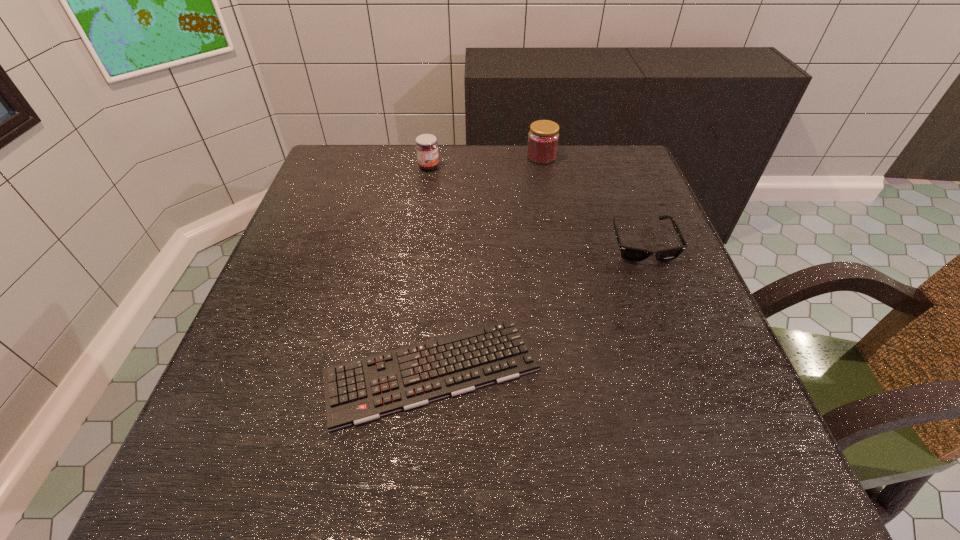
Find the location of `free area in between the left jam and the nearest object`. free area in between the left jam and the nearest object is located at coordinates (430, 268).

The image size is (960, 540). I want to click on free spot between the second nearest object and the right jam, so click(x=591, y=200).

At what (x,y) coordinates should I click in order to perform the action: click on free spot between the rightmost object and the second object from right to left. Please return your answer as a coordinate pair (x, y). This screenshot has width=960, height=540. Looking at the image, I should click on pyautogui.click(x=591, y=200).

You are a GUI agent. You are given a task and a screenshot of the screen. Output one action in this format:
    pyautogui.click(x=<x>, y=<y>)
    Task: Click on the free space that is in between the second object from right to left and the third farthest object
    The image size is (960, 540).
    Given the screenshot: What is the action you would take?
    pyautogui.click(x=591, y=200)

This screenshot has width=960, height=540. I want to click on unoccupied area between the second nearest object and the shortest object, so click(537, 307).

This screenshot has width=960, height=540. In order to click on vacant region between the third farthest object and the second object from right to left in this screenshot , I will do `click(591, 200)`.

You are a GUI agent. You are given a task and a screenshot of the screen. Output one action in this format:
    pyautogui.click(x=<x>, y=<y>)
    Task: Click on the vacant region between the right jam and the left jam
    This screenshot has height=540, width=960.
    Given the screenshot: What is the action you would take?
    pyautogui.click(x=485, y=162)

At what (x,y) coordinates should I click in order to perform the action: click on vacant space that's between the third farthest object and the nearest object. Please return your answer as a coordinate pair (x, y). This screenshot has width=960, height=540. Looking at the image, I should click on (537, 307).

Where is `object that is the third nearest to the nearest object`? object that is the third nearest to the nearest object is located at coordinates (543, 137).

The height and width of the screenshot is (540, 960). Find the location of `object that is the second closest one to the computer keyboard`. object that is the second closest one to the computer keyboard is located at coordinates (426, 145).